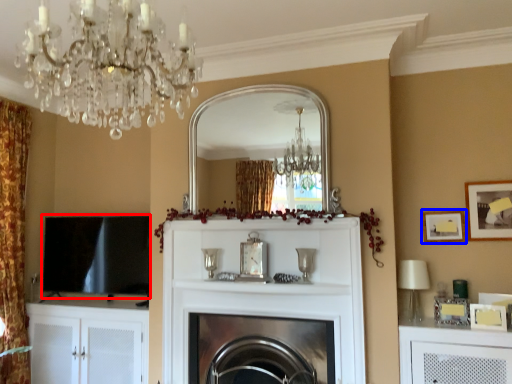
Question: Among these objects, which one is farthest to the camera, window screen (highlighted by a red box) or picture frame (highlighted by a blue box)?

Choices:
 (A) window screen
 (B) picture frame

Answer: (A)